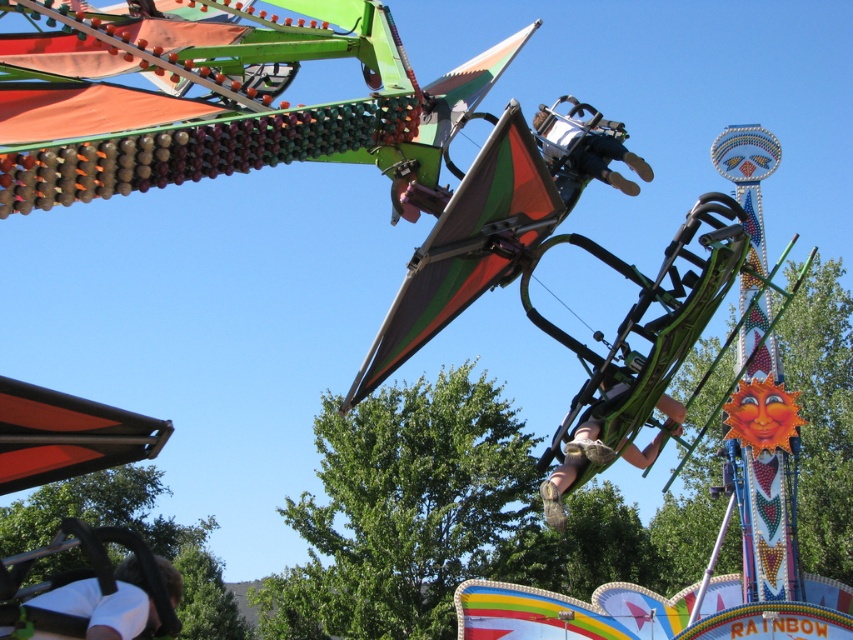
You are a photographer at the fairground and want to capture a photo of the white matte shirt at lower left and the green fabric seat at center. Which object should you focus on first if you want to ensure both are in focus without adjusting the camera settings?

The white matte shirt at lower left is shorter than the green fabric seat at center. To keep both in focus, focus on the green fabric seat at center since it is farther away, as depth of field typically extends further behind the point of focus than in front.

You are a safety inspector checking the amusement ride. You notice the green fabric seat at center and the matte black helmet at center. According to the safety guidelines, all helmets must be positioned to the left of their corresponding seats. Does the current arrangement comply with the guidelines?

The green fabric seat at center is to the right of the matte black helmet at center, meaning the matte black helmet at center is positioned to the left of the green fabric seat at center. This arrangement complies with the safety guidelines requiring helmets to be on the left side of their corresponding seats.

You are a safety inspector evaluating the fairground ride. You notice the green fabric seat at center and the matte black helmet at center. Which object has a greater width?

The green fabric seat at center has a greater width than the matte black helmet at center according to the description.